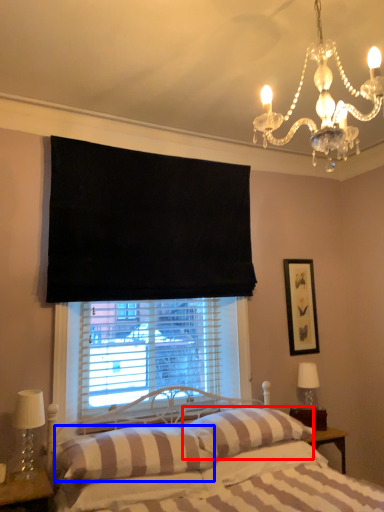
Question: Which of the following is the closest to the observer, pillow (highlighted by a red box) or pillow (highlighted by a blue box)?

Choices:
 (A) pillow
 (B) pillow

Answer: (B)